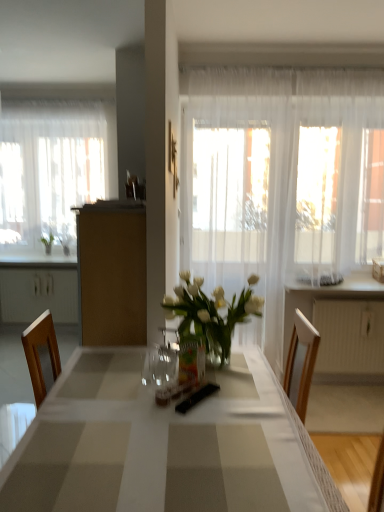
Question: Is white plastic radiator at right shorter than brown matte cabinet at center?

Choices:
 (A) no
 (B) yes

Answer: (B)

Question: Are white plastic radiator at right and brown matte cabinet at center far apart?

Choices:
 (A) no
 (B) yes

Answer: (B)

Question: Could you tell me if white plastic radiator at right is facing brown matte cabinet at center?

Choices:
 (A) no
 (B) yes

Answer: (A)

Question: Is white plastic radiator at right taller than brown matte cabinet at center?

Choices:
 (A) yes
 (B) no

Answer: (B)

Question: Is white plastic radiator at right wider than brown matte cabinet at center?

Choices:
 (A) no
 (B) yes

Answer: (A)

Question: In terms of width, does white glossy countertop at right look wider or thinner when compared to sheer white curtain at left, positioned as the 1th curtain in back-to-front order?

Choices:
 (A) thin
 (B) wide

Answer: (B)

Question: From the image's perspective, is white glossy countertop at right above or below sheer white curtain at left, the 2th curtain viewed from the right?

Choices:
 (A) above
 (B) below

Answer: (B)

Question: From their relative heights in the image, would you say white glossy countertop at right is taller or shorter than sheer white curtain at left, positioned as the 1th curtain in back-to-front order?

Choices:
 (A) tall
 (B) short

Answer: (B)

Question: Is white glossy countertop at right inside the boundaries of sheer white curtain at left, the 1th curtain when ordered from left to right, or outside?

Choices:
 (A) outside
 (B) inside

Answer: (A)

Question: From the image's perspective, is white glossy table at center above or below sheer white curtain at center, which is the first curtain in right-to-left order?

Choices:
 (A) below
 (B) above

Answer: (A)

Question: Is white glossy table at center in front of or behind sheer white curtain at center, the 2th curtain positioned from the left, in the image?

Choices:
 (A) front
 (B) behind

Answer: (A)

Question: In terms of size, does white glossy table at center appear bigger or smaller than sheer white curtain at center, the 2th curtain positioned from the left?

Choices:
 (A) small
 (B) big

Answer: (B)

Question: From a real-world perspective, is white glossy table at center physically located above or below sheer white curtain at center, which is the first curtain in right-to-left order?

Choices:
 (A) below
 (B) above

Answer: (A)

Question: Is sheer white curtain at center, positioned as the 1th curtain in front-to-back order, bigger or smaller than brown matte cabinet at center?

Choices:
 (A) big
 (B) small

Answer: (B)

Question: Is sheer white curtain at center, which is the first curtain in right-to-left order, wider or thinner than brown matte cabinet at center?

Choices:
 (A) wide
 (B) thin

Answer: (B)